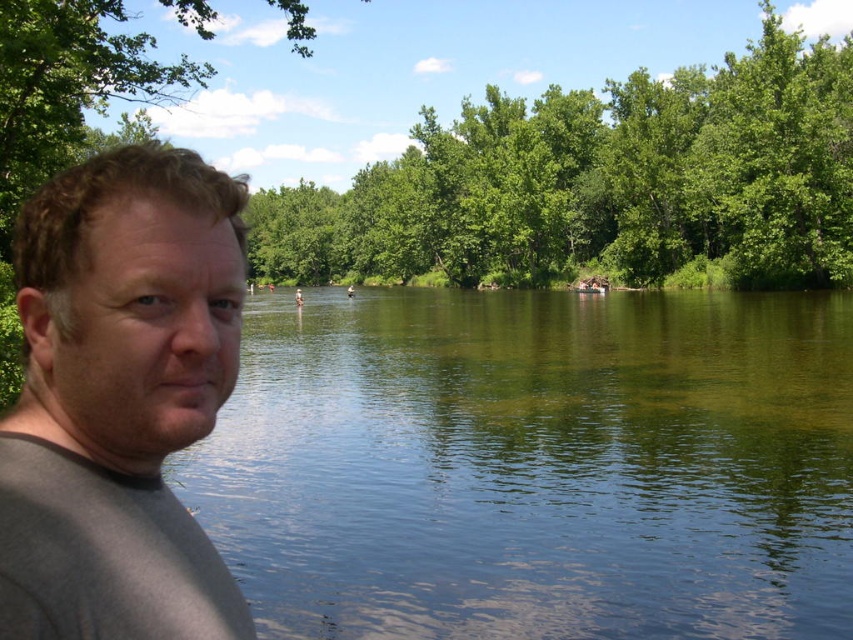
Measure the distance between point (556, 424) and camera.

Point (556, 424) and camera are 25.83 meters apart.

Does green reflective water at center have a larger size compared to green leafy trees at center?

Incorrect, green reflective water at center is not larger than green leafy trees at center.

Where is `green reflective water at center`? Image resolution: width=853 pixels, height=640 pixels. green reflective water at center is located at coordinates (537, 465).

What are the coordinates of `green reflective water at center` in the screenshot? It's located at (537, 465).

Which is more to the right, green reflective water at center or gray matte shirt at left?

green reflective water at center is more to the right.

Is point (705, 596) closer to camera compared to point (242, 243)?

That is False.

Is point (785, 468) less distant than point (97, 406)?

No, it is behind (97, 406).

Where is `green reflective water at center`? green reflective water at center is located at coordinates (537, 465).

Who is more distant from viewer, (373, 220) or (80, 458)?

Point (373, 220)

Does green leafy trees at center have a greater height compared to gray matte shirt at left?

→ Yes, green leafy trees at center is taller than gray matte shirt at left.

Is point (387, 259) behind point (155, 512)?

That is True.

This screenshot has height=640, width=853. Find the location of `green leafy trees at center`. green leafy trees at center is located at coordinates (601, 180).